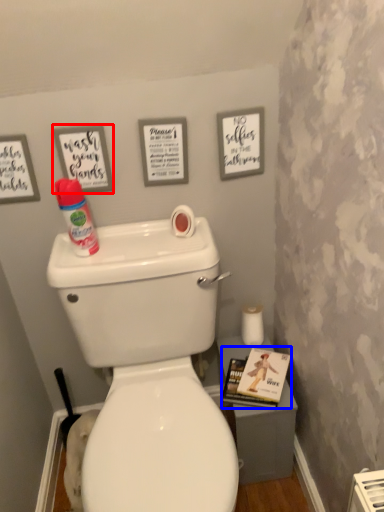
Question: Which object appears farthest to the camera in this image, picture frame (highlighted by a red box) or magazine (highlighted by a blue box)?

Choices:
 (A) picture frame
 (B) magazine

Answer: (B)